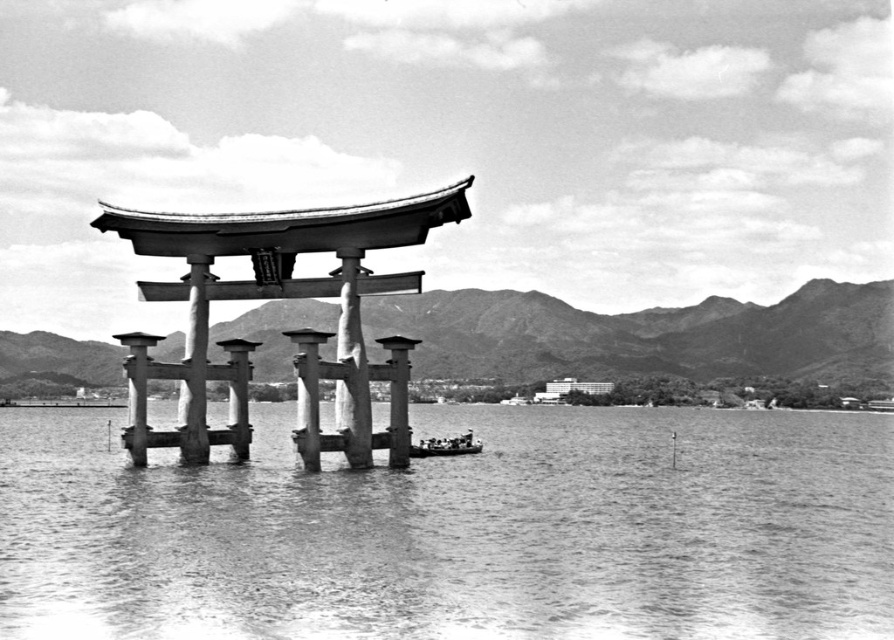
Question: Which object is positioned closest to the smooth gray boat at center?

Choices:
 (A) smooth water at center
 (B) smooth stone torii gate at center

Answer: (B)

Question: Does smooth stone pillar at center appear under smooth gray boat at center?

Choices:
 (A) yes
 (B) no

Answer: (B)

Question: Can you confirm if smooth stone torii gate at center is positioned above smooth gray boat at center?

Choices:
 (A) yes
 (B) no

Answer: (A)

Question: Among these objects, which one is farthest from the camera?

Choices:
 (A) smooth water at center
 (B) smooth gray boat at center
 (C) smooth stone torii gate at center

Answer: (B)

Question: Which of the following is the closest to the observer?

Choices:
 (A) (235, 449)
 (B) (93, 470)

Answer: (A)

Question: Can you confirm if smooth stone torii gate at center is positioned to the right of smooth gray boat at center?

Choices:
 (A) no
 (B) yes

Answer: (A)